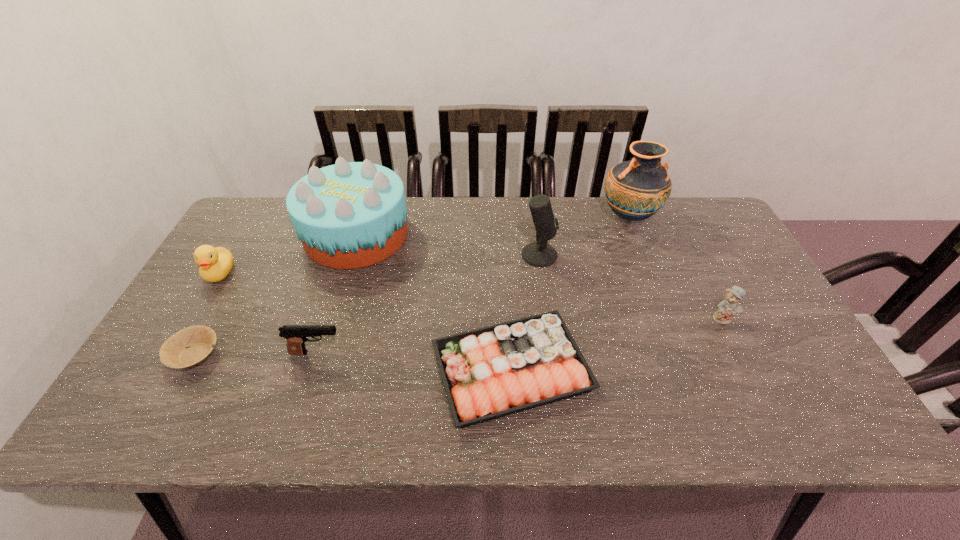
The image size is (960, 540). Find the location of `vacant space located 0.090m on the back of the microphone`. vacant space located 0.090m on the back of the microphone is located at coordinates (535, 226).

Locate an element on the screen. free space located 0.320m on the face of the duckling is located at coordinates (152, 388).

Where is `vacant space located on the front-facing side of the teddy bear`? This screenshot has width=960, height=540. vacant space located on the front-facing side of the teddy bear is located at coordinates (734, 341).

Where is `free space located at the barrel of the pistol`? This screenshot has height=540, width=960. free space located at the barrel of the pistol is located at coordinates (478, 353).

You are a GUI agent. You are given a task and a screenshot of the screen. Output one action in this format:
    pyautogui.click(x=<x>, y=<y>)
    Task: Click on the vacant area situated 0.180m on the back of the platter
    The width and height of the screenshot is (960, 540).
    Given the screenshot: What is the action you would take?
    pyautogui.click(x=506, y=270)

I want to click on vacant space positioned 0.150m on the back of the bowl, so coord(229,292).

Locate an element on the screen. pottery that is positioned at the far edge is located at coordinates click(635, 190).

At what (x,y) coordinates should I click in order to perform the action: click on cake present at the far edge. Please return your answer as a coordinate pair (x, y). Looking at the image, I should click on (350, 215).

Where is `object at the near edge`? This screenshot has height=540, width=960. object at the near edge is located at coordinates (488, 373).

I want to click on duckling located in the left edge section of the desktop, so click(x=215, y=264).